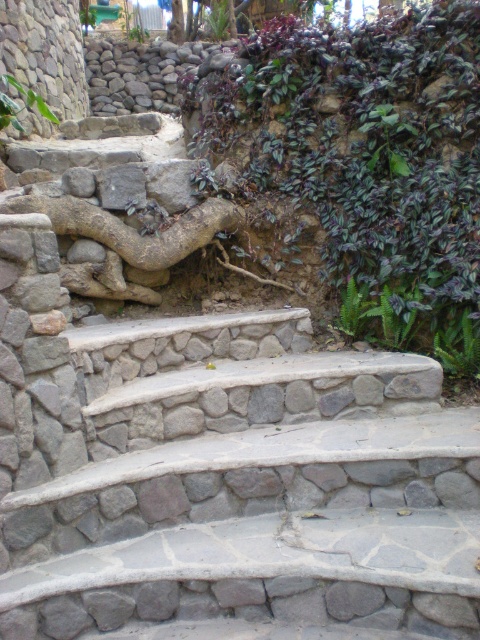
You are a hiker planning to take a photo of the purple leafy plant at upper right and the rough stone wall at upper left. Which object will appear bigger in the photo?

The purple leafy plant at upper right will appear bigger in the photo because it has a larger size compared to the rough stone wall at upper left.

You are standing at the bottom of the natural stone stairs at center and want to reach the green leafy plant at lower right. Which direction should you move to get closer to the plant?

The natural stone stairs at center is located below the green leafy plant at lower right, so you should move upwards to get closer to the plant.